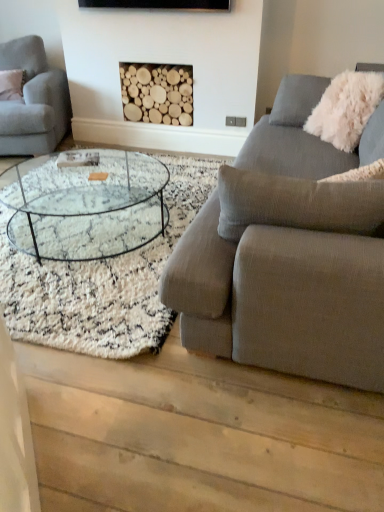
Question: From a real-world perspective, is white fluffy pillow at upper right on top of light gray fabric couch at left, the 2th studio couch when ordered from front to back?

Choices:
 (A) no
 (B) yes

Answer: (B)

Question: From the image's perspective, does white fluffy pillow at upper right appear lower than light gray fabric couch at left, the 2th studio couch when ordered from front to back?

Choices:
 (A) yes
 (B) no

Answer: (A)

Question: From the image's perspective, is white fluffy pillow at upper right above light gray fabric couch at left, which is the 1th studio couch in left-to-right order?

Choices:
 (A) yes
 (B) no

Answer: (B)

Question: Can you confirm if white fluffy pillow at upper right is thinner than light gray fabric couch at left, the 2th studio couch when ordered from front to back?

Choices:
 (A) no
 (B) yes

Answer: (B)

Question: Is white fluffy pillow at upper right oriented towards light gray fabric couch at left, which is the 1th studio couch in left-to-right order?

Choices:
 (A) yes
 (B) no

Answer: (B)

Question: Is white fluffy pillow at upper right wider than light gray fabric couch at left, which appears as the 1th studio couch when viewed from the back?

Choices:
 (A) no
 (B) yes

Answer: (A)

Question: Considering the relative sizes of white fluffy pillow at upper right and textured gray couch at right, marked as the second studio couch in a left-to-right arrangement, in the image provided, is white fluffy pillow at upper right smaller than textured gray couch at right, marked as the second studio couch in a left-to-right arrangement,?

Choices:
 (A) no
 (B) yes

Answer: (B)

Question: Is white fluffy pillow at upper right in contact with textured gray couch at right, positioned as the second studio couch in back-to-front order?

Choices:
 (A) no
 (B) yes

Answer: (A)

Question: Is white fluffy pillow at upper right not close to textured gray couch at right, the 1th studio couch from the right?

Choices:
 (A) no
 (B) yes

Answer: (B)

Question: Can you confirm if white fluffy pillow at upper right is shorter than textured gray couch at right, the 1th studio couch from the right?

Choices:
 (A) no
 (B) yes

Answer: (B)

Question: Is white fluffy pillow at upper right looking in the opposite direction of textured gray couch at right, marked as the second studio couch in a left-to-right arrangement?

Choices:
 (A) no
 (B) yes

Answer: (B)

Question: Is white fluffy pillow at upper right at the right side of textured gray couch at right, the 1th studio couch from the right?

Choices:
 (A) yes
 (B) no

Answer: (A)

Question: Does natural wood logs at center appear on the left side of textured gray couch at right, the first studio couch when ordered from front to back?

Choices:
 (A) yes
 (B) no

Answer: (A)